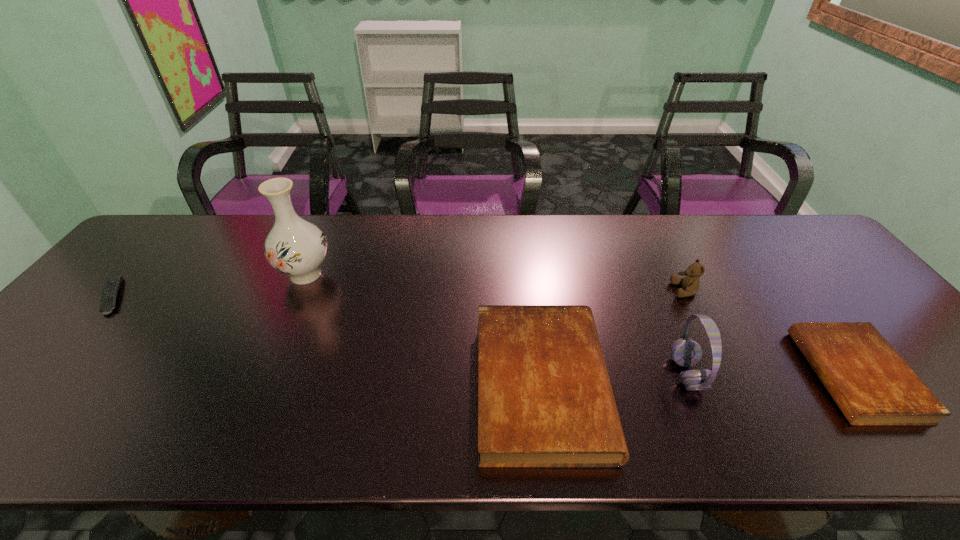
Image resolution: width=960 pixels, height=540 pixels. Identify the location of free region at the near edge. (179, 376).

Locate an element on the screen. Image resolution: width=960 pixels, height=540 pixels. vacant space at the left edge of the desktop is located at coordinates (128, 325).

The image size is (960, 540). Identify the location of free space at the right edge of the desktop. (889, 321).

The image size is (960, 540). In order to click on vacant space at the far left corner of the desktop in this screenshot , I will do `click(177, 216)`.

In order to click on free space between the second tallest object and the remote control in this screenshot , I will do `click(399, 335)`.

Locate an element on the screen. This screenshot has height=540, width=960. empty location between the remote control and the third tallest object is located at coordinates (398, 293).

At what (x,y) coordinates should I click in order to perform the action: click on empty space that is in between the vase and the leftmost object. Please return your answer as a coordinate pair (x, y). This screenshot has width=960, height=540. Looking at the image, I should click on (209, 285).

The height and width of the screenshot is (540, 960). Find the location of `free point between the second object from right to left and the left Bible`. free point between the second object from right to left and the left Bible is located at coordinates (613, 338).

What are the coordinates of `object that ranks as the closest to the headset` in the screenshot? It's located at (545, 400).

Select which object appears as the closest to the fifth object from right to left. Please provide its 2D coordinates. Your answer should be formatted as a tuple, i.e. [(x, y)], where the tuple contains the x and y coordinates of a point satisfying the conditions above.

[(112, 285)]